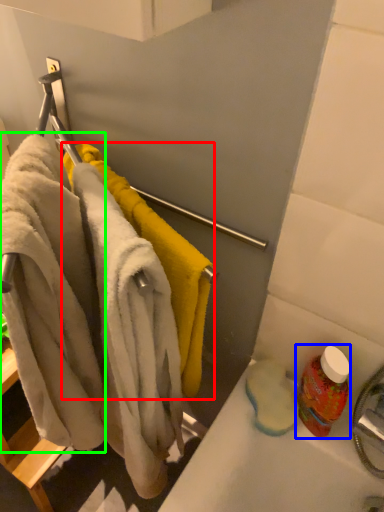
Question: Considering the real-world distances, which object is closest to towel (highlighted by a red box)? cleaning product (highlighted by a blue box) or bath towel (highlighted by a green box).

Choices:
 (A) cleaning product
 (B) bath towel

Answer: (B)